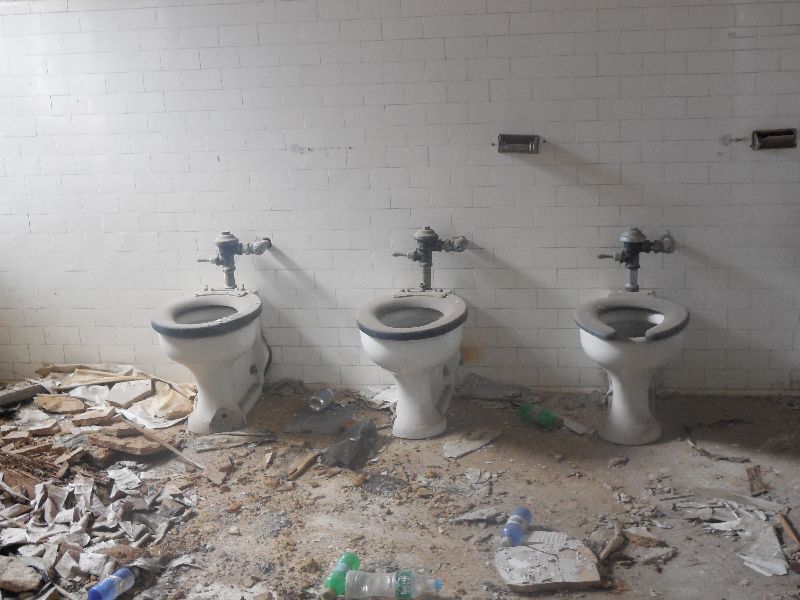
Where is `bottle`? bottle is located at coordinates (514, 525).